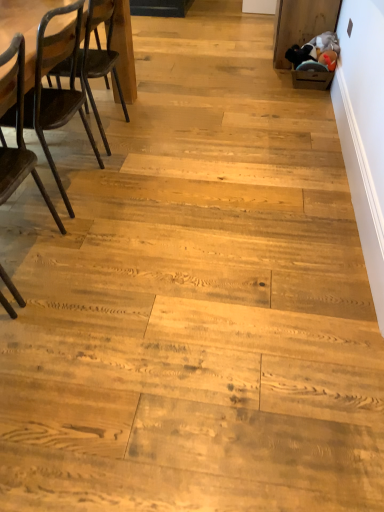
Where is `free point to the right of dark brown wood table at left`? The height and width of the screenshot is (512, 384). free point to the right of dark brown wood table at left is located at coordinates (167, 136).